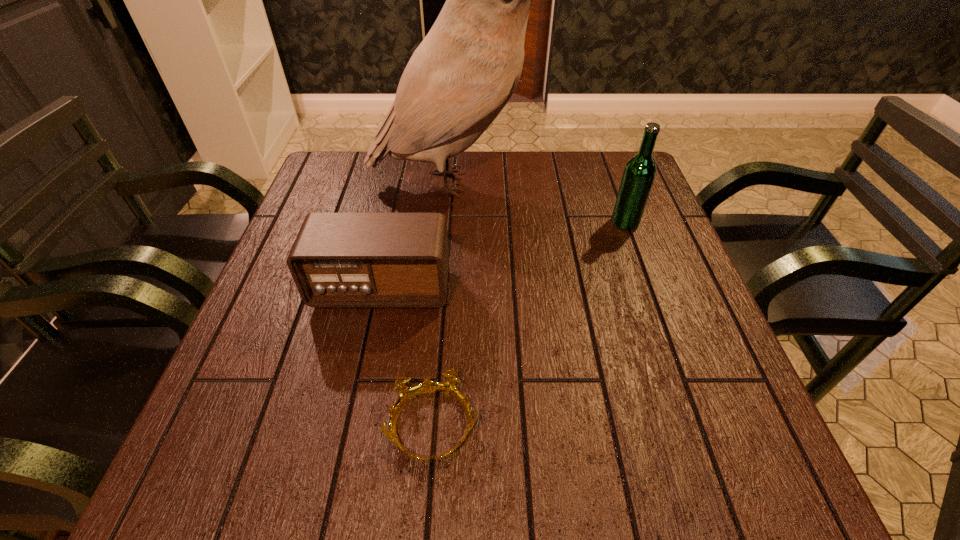
The image size is (960, 540). I want to click on the tallest object, so click(x=463, y=73).

I want to click on the farthest object, so click(x=463, y=73).

Identify the location of the second farthest object. This screenshot has height=540, width=960. (639, 173).

Locate an element on the screen. The image size is (960, 540). the third shortest object is located at coordinates (639, 173).

The height and width of the screenshot is (540, 960). In order to click on radio receiver in this screenshot , I will do [x=338, y=260].

Image resolution: width=960 pixels, height=540 pixels. In order to click on the third tallest object in this screenshot , I will do `click(338, 260)`.

At what (x,y) coordinates should I click in order to perform the action: click on the nearest object. Please return your answer as a coordinate pair (x, y). This screenshot has width=960, height=540. Looking at the image, I should click on (406, 393).

Image resolution: width=960 pixels, height=540 pixels. What are the coordinates of `the shortest object` in the screenshot? It's located at (406, 393).

This screenshot has width=960, height=540. In order to click on vacant point located 0.250m on the face of the tallest object in this screenshot , I will do `click(627, 183)`.

Find the location of a particular element. blank space located 0.170m on the front of the second farthest object is located at coordinates (646, 281).